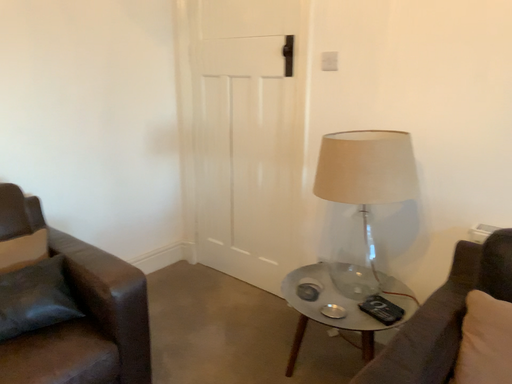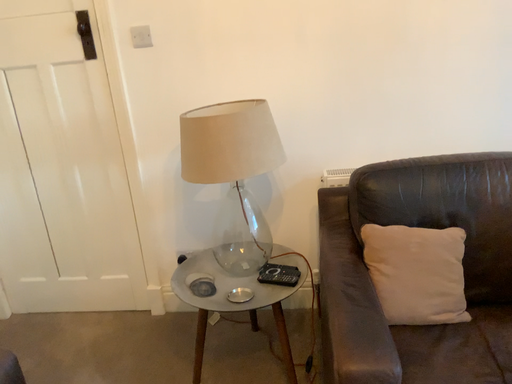
Question: How did the camera likely rotate when shooting the video?

Choices:
 (A) rotated left
 (B) rotated right

Answer: (B)